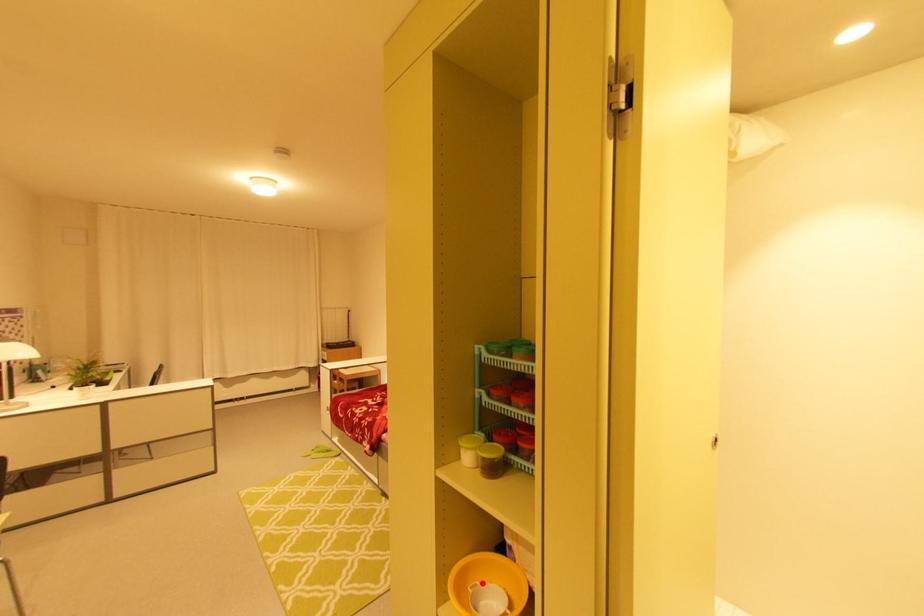
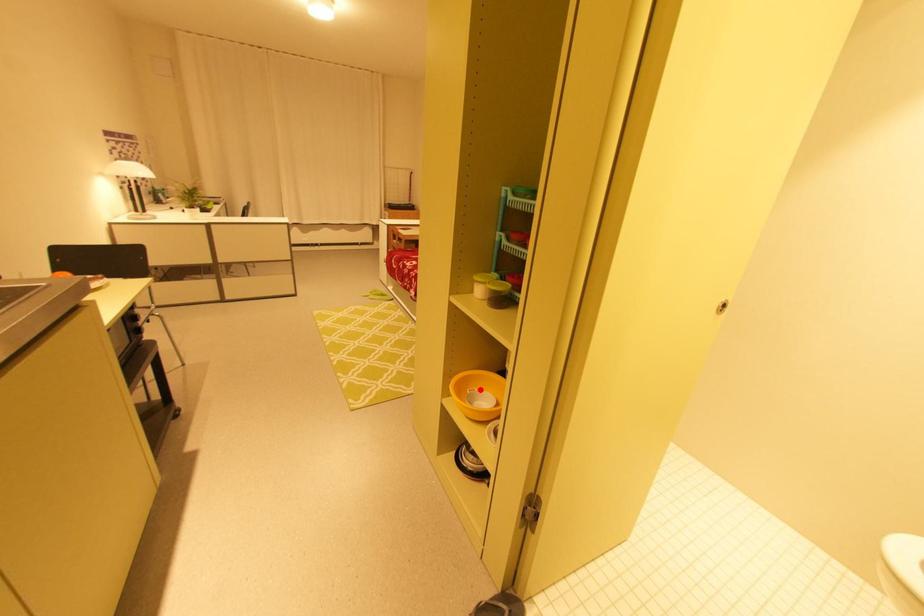
I am providing you with two images of the same scene from different viewpoints. A red point is marked on the first image and another point is marked on the second image. Does the point marked in image1 correspond to the same location as the one in image2?

Yes